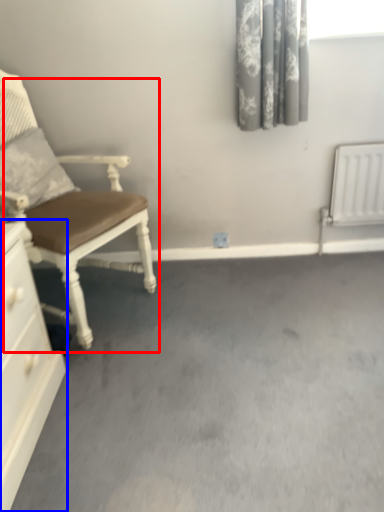
Question: Which of the following is the farthest to the observer, chair (highlighted by a red box) or chest of drawers (highlighted by a blue box)?

Choices:
 (A) chair
 (B) chest of drawers

Answer: (A)